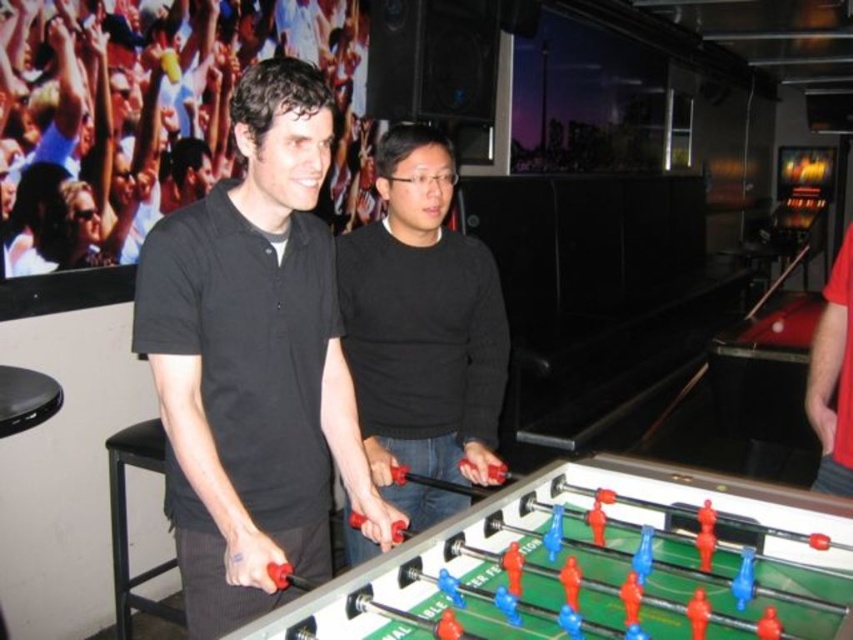
Does black matte shirt at left lie behind black matte sweater at center?

That is False.

Who is lower down, black matte shirt at left or black matte sweater at center?

Positioned lower is black matte shirt at left.

Which is behind, point (158, 307) or point (408, 522)?

The point (408, 522) is more distant.

You are a GUI agent. You are given a task and a screenshot of the screen. Output one action in this format:
    pyautogui.click(x=<x>, y=<y>)
    Task: Click on the black matte shirt at left
    This screenshot has height=640, width=853.
    Given the screenshot: What is the action you would take?
    pyautogui.click(x=254, y=362)

Which of these two, black matte shirt at upper left or red fabric sleeve at right, stands taller?

black matte shirt at upper left is taller.

Does black matte shirt at upper left have a greater height compared to red fabric sleeve at right?

Correct, black matte shirt at upper left is much taller as red fabric sleeve at right.

Between point (16, 38) and point (844, 420), which one is positioned in front?

Point (844, 420) is more forward.

At what (x,y) coordinates should I click in order to perform the action: click on black matte shirt at upper left. Please return your answer as a coordinate pair (x, y). The height and width of the screenshot is (640, 853). Looking at the image, I should click on (144, 113).

Can you confirm if black matte shirt at left is taller than red fabric sleeve at right?

Indeed, black matte shirt at left has a greater height compared to red fabric sleeve at right.

Which is more to the left, black matte shirt at left or red fabric sleeve at right?

Positioned to the left is black matte shirt at left.

Locate an element on the screen. This screenshot has height=640, width=853. black matte shirt at left is located at coordinates (254, 362).